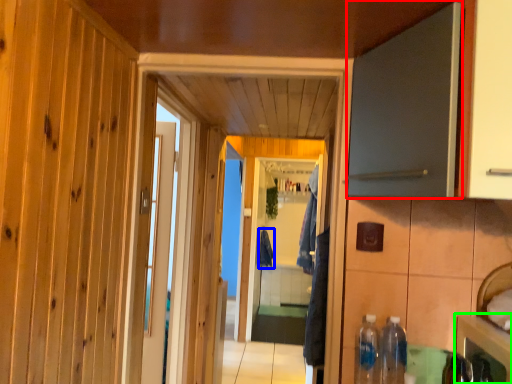
Question: Which is nearer to the door (highlighted by a red box)? laundry (highlighted by a blue box) or cabinetry (highlighted by a green box).

Choices:
 (A) laundry
 (B) cabinetry

Answer: (B)